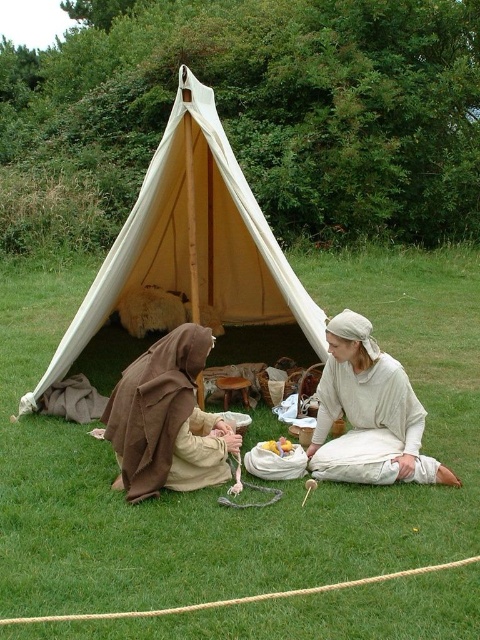
From the picture: Does green grass at center have a lesser width compared to brown cloth at lower left?

Incorrect, green grass at center's width is not less than brown cloth at lower left's.

Does point (55, 452) lie behind point (131, 426)?

Yes.

Where is `green grass at center`? The width and height of the screenshot is (480, 640). green grass at center is located at coordinates coord(226,484).

Which is below, beige canvas tent at center or light beige fabric at center?

light beige fabric at center is lower down.

How distant is beige canvas tent at center from light beige fabric at center?

A distance of 1.27 meters exists between beige canvas tent at center and light beige fabric at center.

Describe the element at coordinates (192, 241) in the screenshot. I see `beige canvas tent at center` at that location.

Identify the location of beige canvas tent at center. The image size is (480, 640). (192, 241).

Between green grass at center and light beige fabric at center, which one has less height?

light beige fabric at center

In the scene shown: Which is above, green grass at center or light beige fabric at center?

green grass at center is above.

This screenshot has height=640, width=480. Find the location of `green grass at center`. green grass at center is located at coordinates (226, 484).

Image resolution: width=480 pixels, height=640 pixels. What are the coordinates of `green grass at center` in the screenshot? It's located at (226, 484).